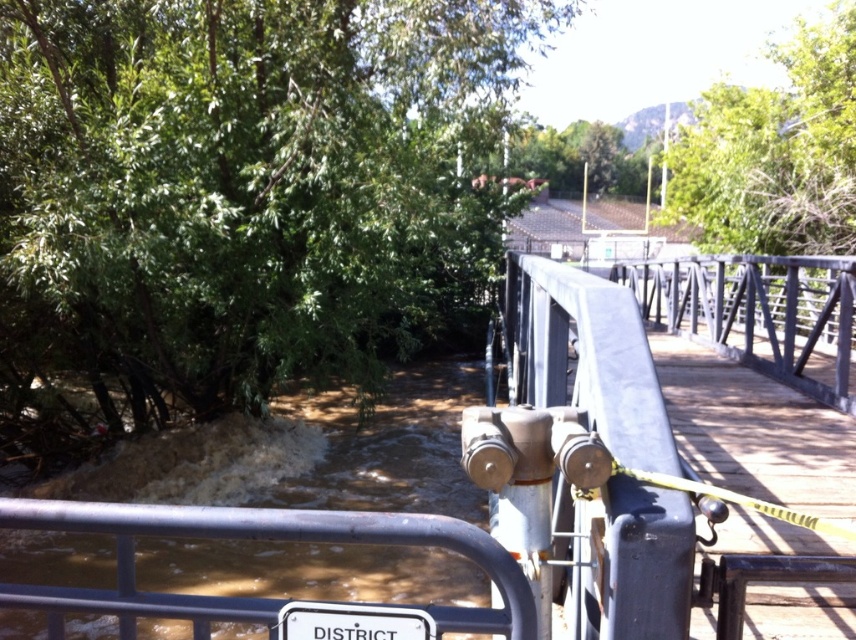
From the picture: You are standing on the flooded bridge and want to reach a point closer to you. Which point should you move towards, point [495,620] or point [417,611]?

Point [417,611] is closer to you than point [495,620], so you should move towards point [417,611].

You are standing on the flooded pedestrian bridge and want to reach the gray metallic rail at center. Given the coordinates provided, can you determine the direction you should walk from your current position at point (759, 314) to reach the rail?

The point (759, 314) marks the gray metallic rail at center, so you are already at the rail.

Based on the scene description, what object is located at the coordinates point (254, 538)?

The point (254, 538) marks the brushed metal railing at center.